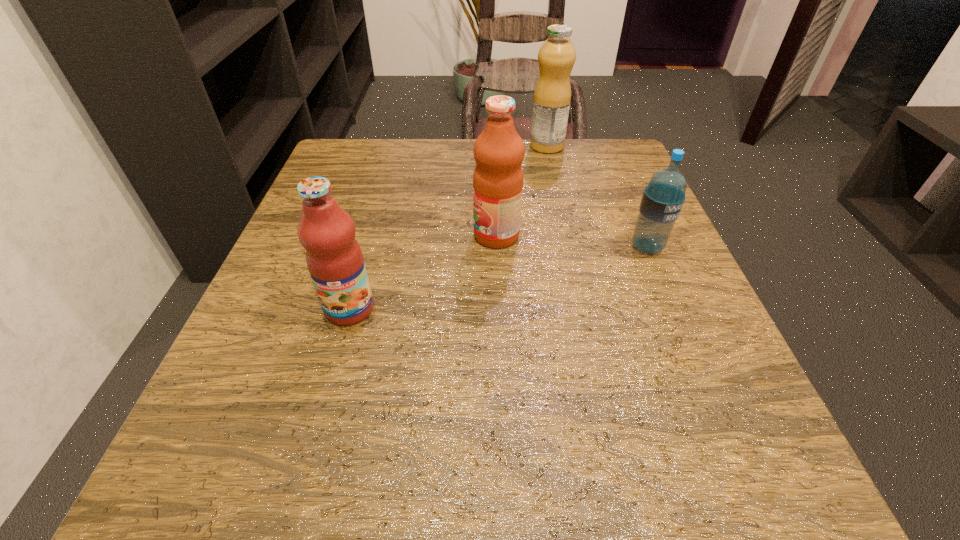
Identify which fruit juice is the second closest to the nearest object. Please provide its 2D coordinates. Your answer should be formatted as a tuple, i.e. [(x, y)], where the tuple contains the x and y coordinates of a point satisfying the conditions above.

[(552, 96)]

Find the location of a particular element. Image resolution: width=960 pixels, height=540 pixels. blank space that satisfies the following two spatial constraints: 1. on the front label of the second farthest fruit juice; 2. on the front label of the nearest object is located at coordinates (499, 309).

The width and height of the screenshot is (960, 540). In order to click on free space in the image that satisfies the following two spatial constraints: 1. on the front label of the rightmost object; 2. on the left side of the rightmost fruit juice in this screenshot , I will do `click(569, 247)`.

Where is `vacant area that satisfies the following two spatial constraints: 1. on the front label of the farthest fruit juice; 2. on the front label of the nearest object`? The height and width of the screenshot is (540, 960). vacant area that satisfies the following two spatial constraints: 1. on the front label of the farthest fruit juice; 2. on the front label of the nearest object is located at coordinates (584, 309).

Locate an element on the screen. The width and height of the screenshot is (960, 540). vacant space that satisfies the following two spatial constraints: 1. on the front label of the third object from right to left; 2. on the front label of the nearest object is located at coordinates (499, 309).

Locate an element on the screen. The height and width of the screenshot is (540, 960). free space that satisfies the following two spatial constraints: 1. on the front label of the second fruit juice from right to left; 2. on the front label of the nearest fruit juice is located at coordinates 499,309.

The width and height of the screenshot is (960, 540). I want to click on free space that satisfies the following two spatial constraints: 1. on the front label of the second object from left to right; 2. on the front label of the nearest fruit juice, so click(499, 309).

Where is `free space that satisfies the following two spatial constraints: 1. on the front label of the second object from left to right; 2. on the front label of the nearest object`? free space that satisfies the following two spatial constraints: 1. on the front label of the second object from left to right; 2. on the front label of the nearest object is located at coordinates (499, 309).

Find the location of `vacant region that satisfies the following two spatial constraints: 1. on the front label of the farthest fruit juice; 2. on the front label of the leftmost fruit juice`. vacant region that satisfies the following two spatial constraints: 1. on the front label of the farthest fruit juice; 2. on the front label of the leftmost fruit juice is located at coordinates (584, 309).

Image resolution: width=960 pixels, height=540 pixels. Identify the location of vacant point that satisfies the following two spatial constraints: 1. on the front label of the second object from right to left; 2. on the front label of the leftmost object. (584, 309).